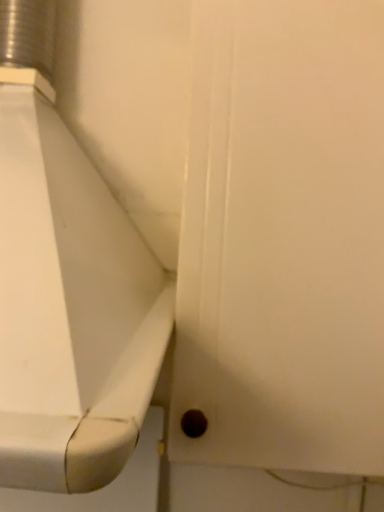
Where is `white glossy toilet at lower left`? The image size is (384, 512). white glossy toilet at lower left is located at coordinates (69, 305).

What is the approximate width of white glossy toilet at lower left?

white glossy toilet at lower left is 50.49 centimeters in width.

In order to face white glossy toilet at lower left, should I rotate leftwards or rightwards?

A 19.525 degree turn to the left will do.

What do you see at coordinates (69, 305) in the screenshot? This screenshot has height=512, width=384. I see `white glossy toilet at lower left` at bounding box center [69, 305].

Find the location of a particular element. white glossy toilet at lower left is located at coordinates (69, 305).